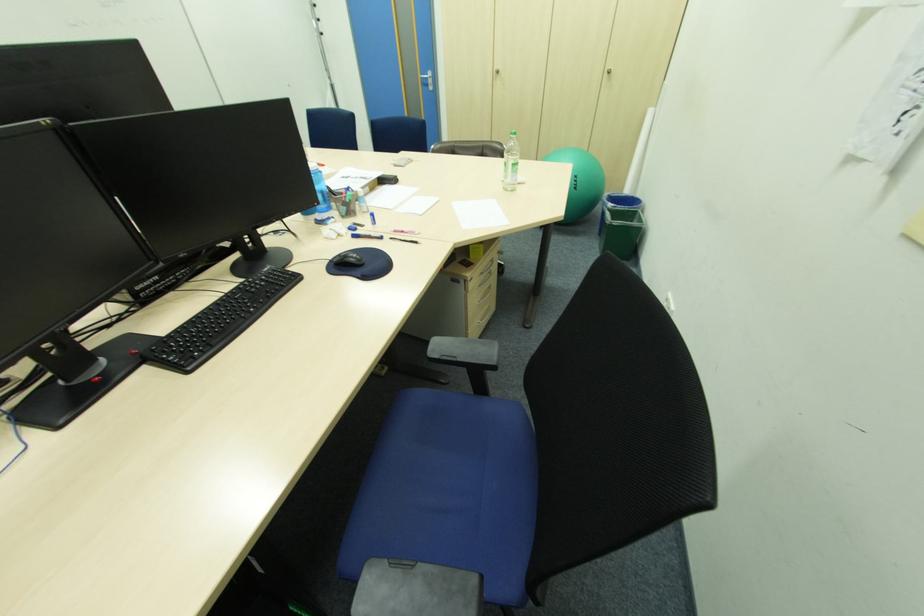
Which object does [622,232] point to?

It corresponds to the green trash can in the image.